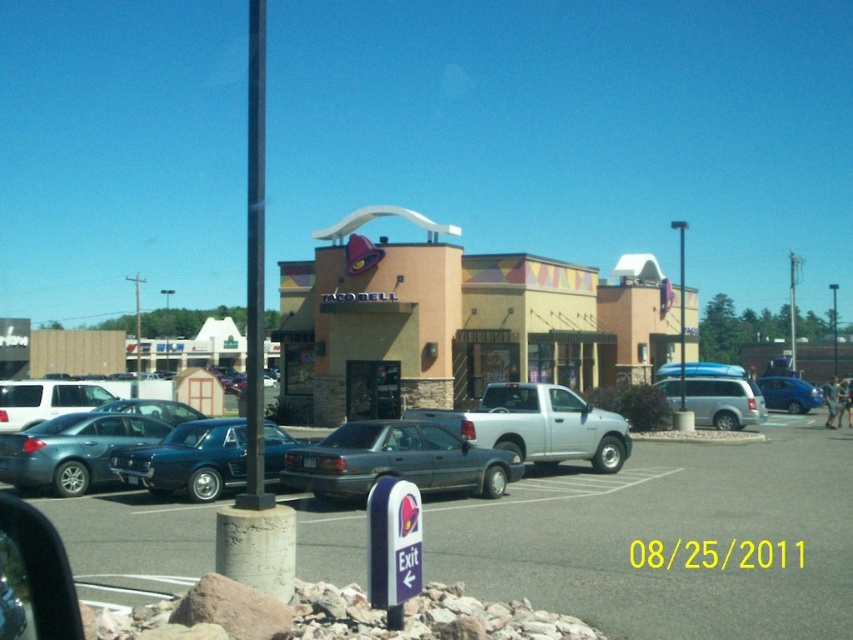
Who is positioned more to the right, gray asphalt parking lot at center or beige stucco taco bell at center?

Positioned to the right is gray asphalt parking lot at center.

Is point (840, 438) in front of point (357, 244)?

Yes, it is.

The width and height of the screenshot is (853, 640). I want to click on gray asphalt parking lot at center, so click(669, 538).

Between gray matte sedan at center and metallic blue sedan at center, which one is positioned lower?

metallic blue sedan at center is lower down.

Between gray matte sedan at center and metallic blue sedan at center, which one is positioned higher?

gray matte sedan at center

You are a GUI agent. You are given a task and a screenshot of the screen. Output one action in this format:
    pyautogui.click(x=<x>, y=<y>)
    Task: Click on the gray matte sedan at center
    This screenshot has width=853, height=640.
    Given the screenshot: What is the action you would take?
    pyautogui.click(x=397, y=460)

Who is more distant from viewer, (699, 378) or (683, 288)?

Point (683, 288)

Between silver metallic van at center and brushed metal pole at center, which one appears on the left side from the viewer's perspective?

Positioned to the left is silver metallic van at center.

Find the location of a particular element. silver metallic van at center is located at coordinates (723, 401).